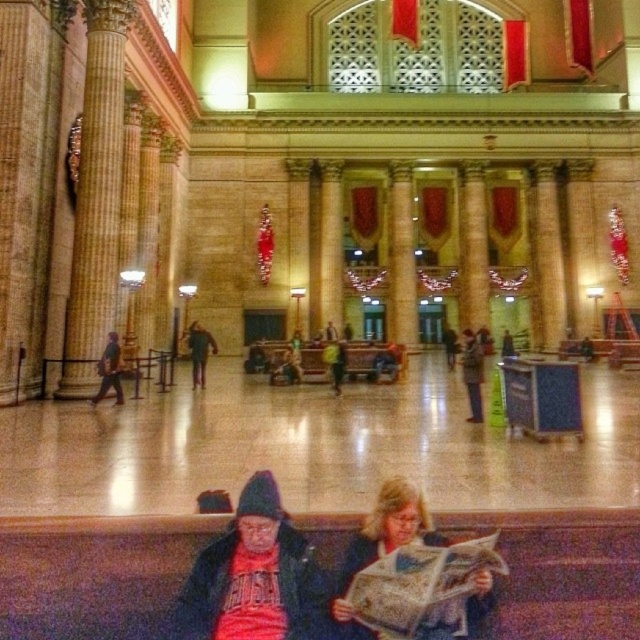
Based on the photo, you are standing at the entrance of the train station and see the matte red shirt at lower center and the matte black jacket at lower center. Which one is nearer to you?

The matte red shirt at lower center is closer to the viewer than the matte black jacket at lower center, so the matte red shirt at lower center is nearer to you.

You are a photographer standing at the entrance of the train station. You want to take a photo that includes both the red knit cap at lower center and the dark brown leather jacket at center. Which object should you adjust your camera angle to ensure both are fully visible?

The red knit cap at lower center is in front of the dark brown leather jacket at center. To ensure both are fully visible, you should adjust your camera angle to capture the red knit cap at lower center and the dark brown leather jacket at center without one blocking the other.